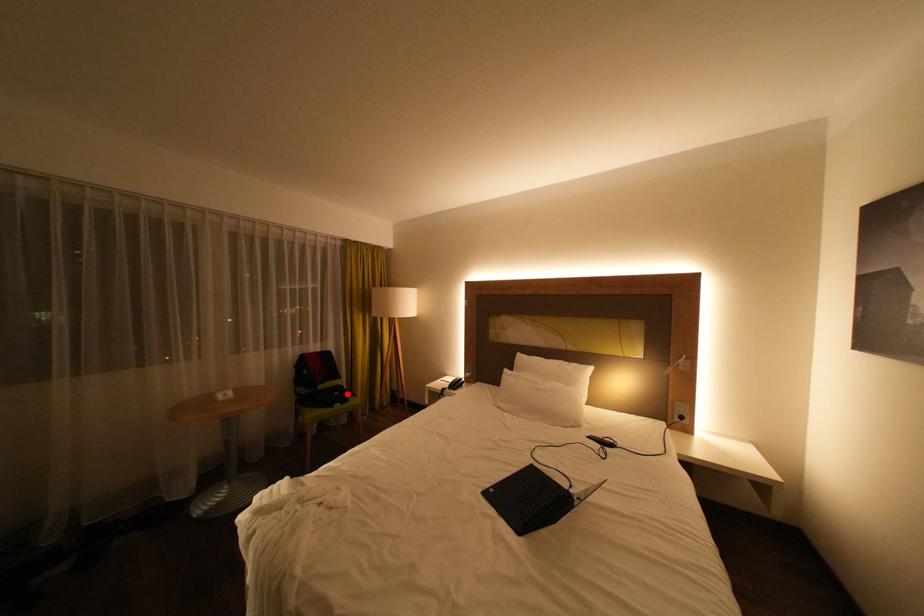
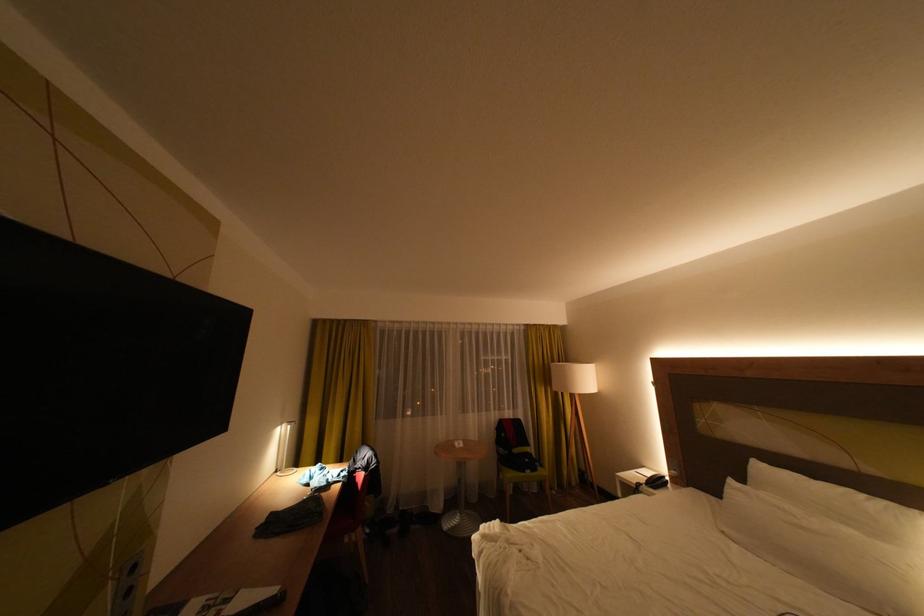
Question: I am providing you with two images of the same scene from different viewpoints. A red point is shown in image1. For the corresponding object point in image2, is it positioned nearer or farther from the camera?

Choices:
 (A) Nearer
 (B) Farther

Answer: (B)